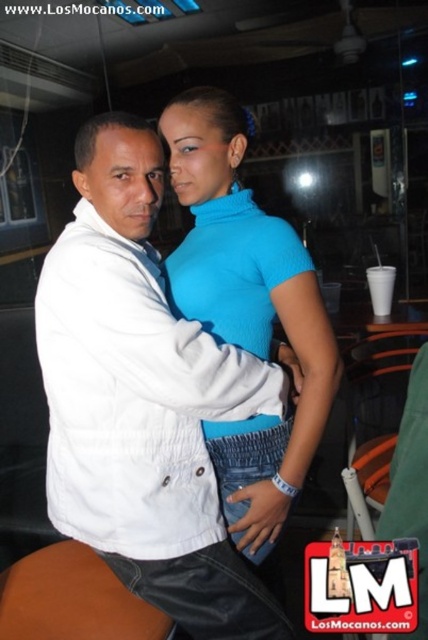
Is white matte jacket at center taller than brown leather stool at lower left?

Indeed, white matte jacket at center has a greater height compared to brown leather stool at lower left.

Is white matte jacket at center positioned before brown leather stool at lower left?

Yes, white matte jacket at center is closer to the viewer.

Measure the distance between white matte jacket at center and camera.

They are 37.98 inches apart.

Locate an element on the screen. Image resolution: width=428 pixels, height=640 pixels. white matte jacket at center is located at coordinates (142, 400).

Is blue turtleneck at center wider than brown leather stool at lower left?

Incorrect, blue turtleneck at center's width does not surpass brown leather stool at lower left's.

Is blue turtleneck at center smaller than brown leather stool at lower left?

No, blue turtleneck at center is not smaller than brown leather stool at lower left.

Between point (208, 204) and point (35, 561), which one is positioned behind?

Positioned behind is point (35, 561).

Where is `blue turtleneck at center`? blue turtleneck at center is located at coordinates (246, 310).

Is point (107, 285) positioned behind point (162, 134)?

No.

Is white matte jacket at center wider than blue turtleneck at center?

Yes.

The height and width of the screenshot is (640, 428). What do you see at coordinates (142, 400) in the screenshot? I see `white matte jacket at center` at bounding box center [142, 400].

Locate an element on the screen. This screenshot has width=428, height=640. white matte jacket at center is located at coordinates (142, 400).